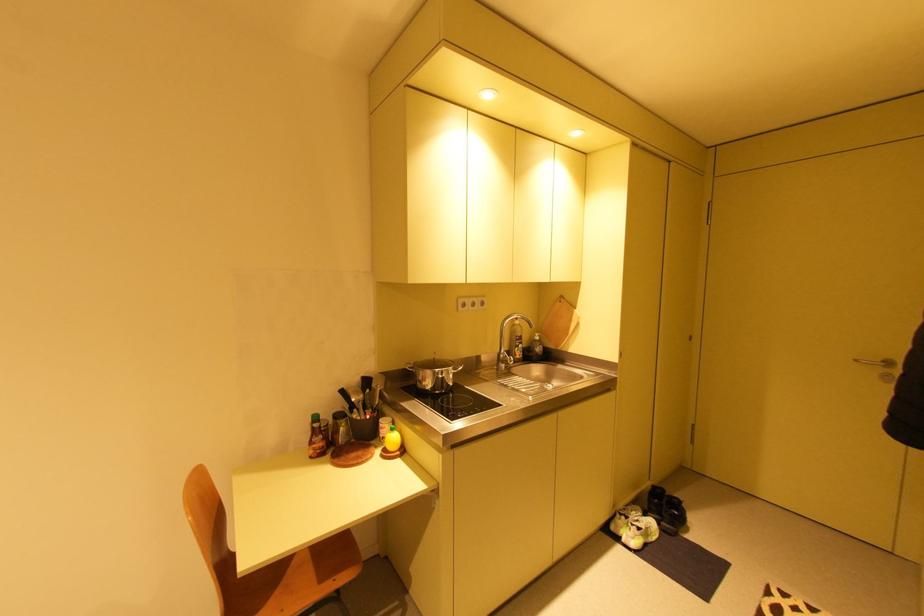
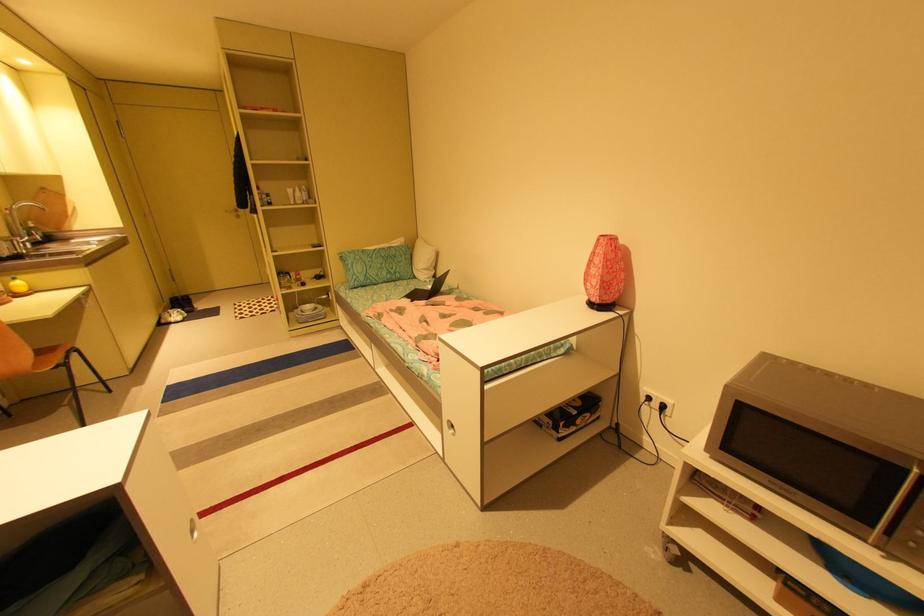
In the second image, find the point that corresponds to the point at 861,361 in the first image.

(232, 211)